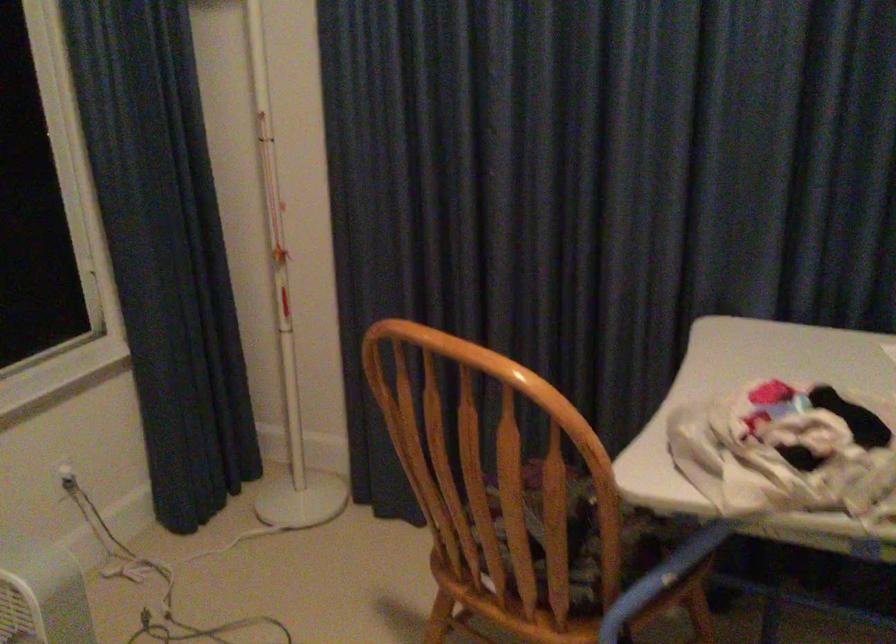
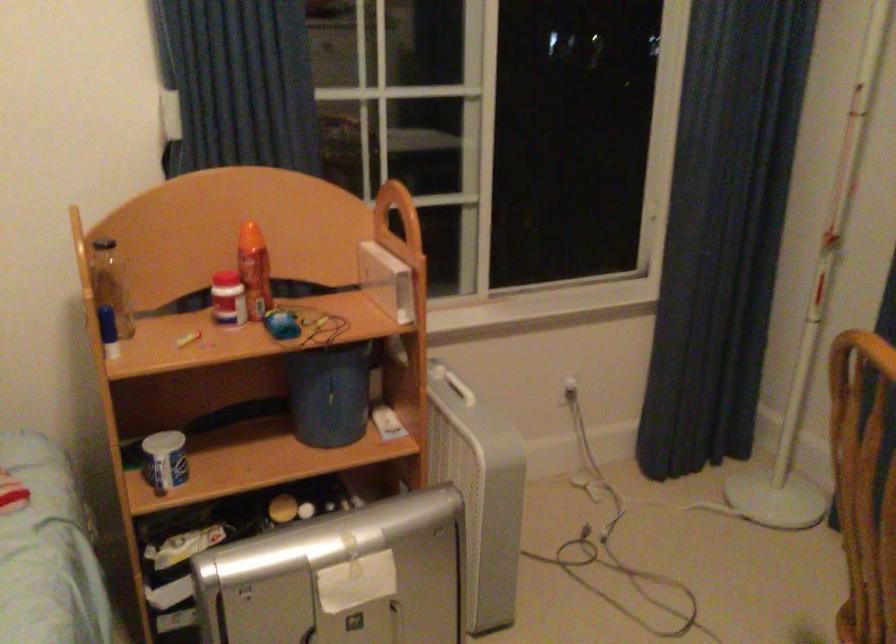
Where in the second image is the point corresponding to pixel 440 444 from the first image?

(864, 484)